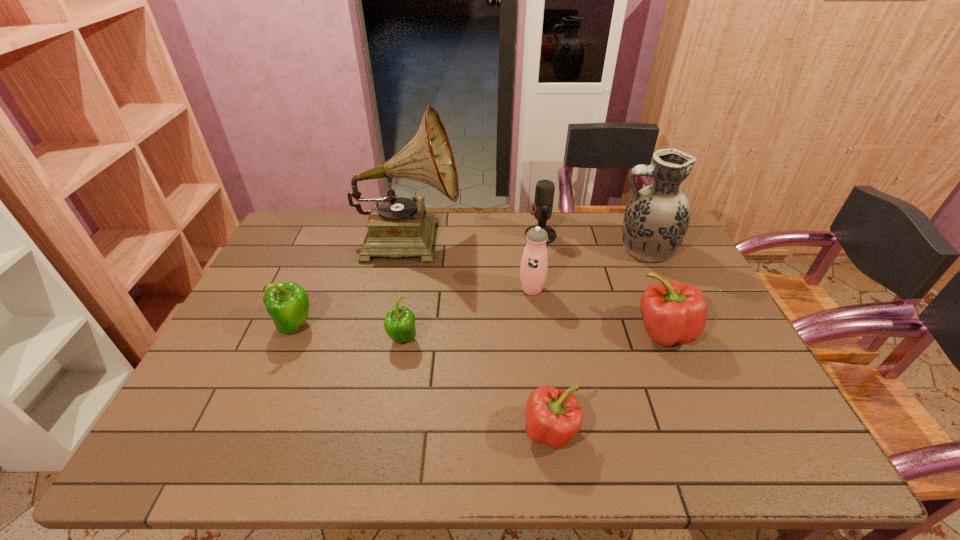
Identify the location of vacant space located on the side of the microphone with the red ring. (493, 235).

This screenshot has width=960, height=540. What are the coordinates of `free space located 0.080m on the back of the leftmost object` in the screenshot? It's located at (309, 293).

Locate an element on the screen. The image size is (960, 540). free space located on the front of the farther pink bell pepper is located at coordinates (683, 377).

Identify the location of vacant region located 0.350m on the back of the smaller green bell pepper. The height and width of the screenshot is (540, 960). (419, 251).

Where is `free spot located 0.140m on the back of the nearer pink bell pepper`? free spot located 0.140m on the back of the nearer pink bell pepper is located at coordinates (540, 360).

Locate an element on the screen. The image size is (960, 540). record player at the far edge is located at coordinates (397, 226).

This screenshot has height=540, width=960. What are the coordinates of `vase that is at the far edge` in the screenshot? It's located at point(656,219).

Identify the location of microphone situated at the far edge. This screenshot has width=960, height=540. (542, 207).

Where is `object at the near edge`? The width and height of the screenshot is (960, 540). object at the near edge is located at coordinates (553, 416).

Locate an element on the screen. This screenshot has height=540, width=960. object present at the left edge is located at coordinates (288, 304).